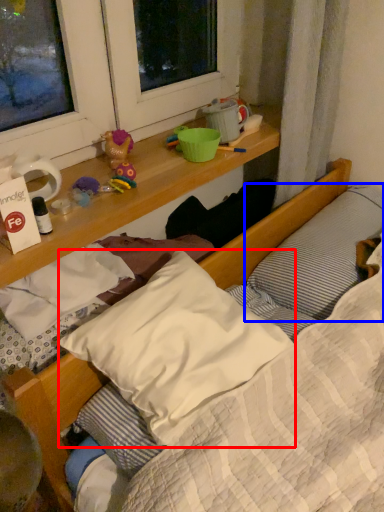
Question: Which point is closer to the camera, pillow (highlighted by a red box) or pillow (highlighted by a blue box)?

Choices:
 (A) pillow
 (B) pillow

Answer: (A)